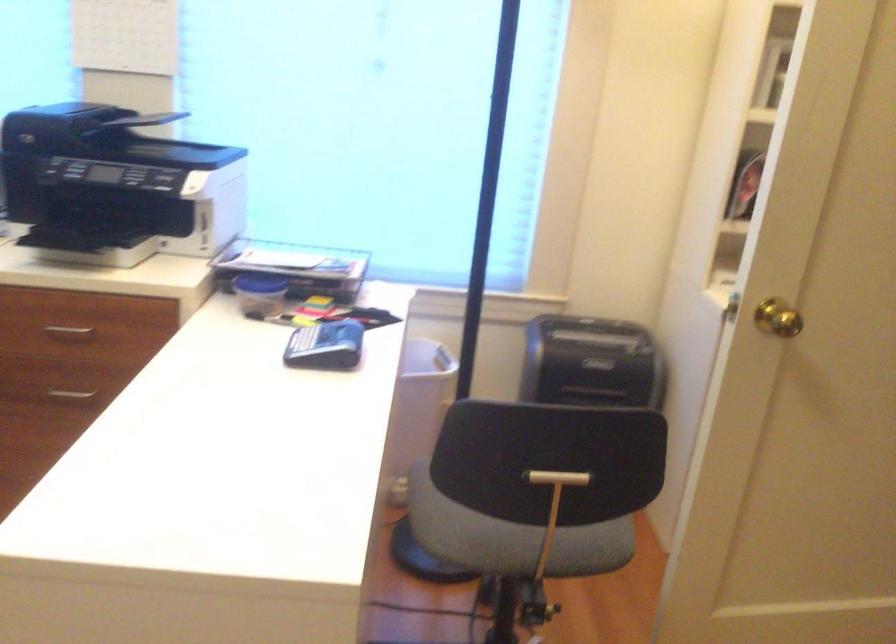
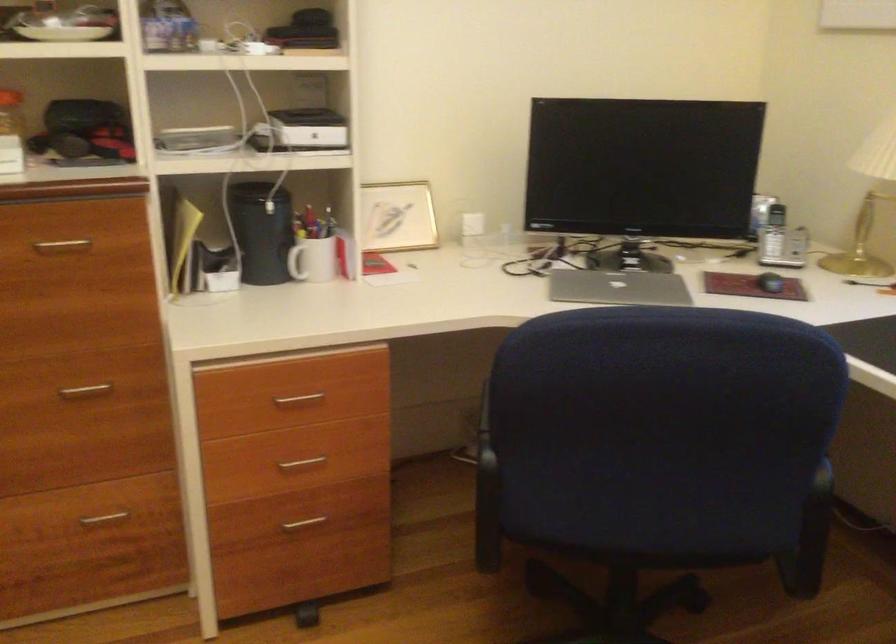
Question: The first image is from the beginning of the video and the second image is from the end. How did the camera likely rotate when shooting the video?

Choices:
 (A) Left
 (B) Right
 (C) Up
 (D) Down

Answer: (A)